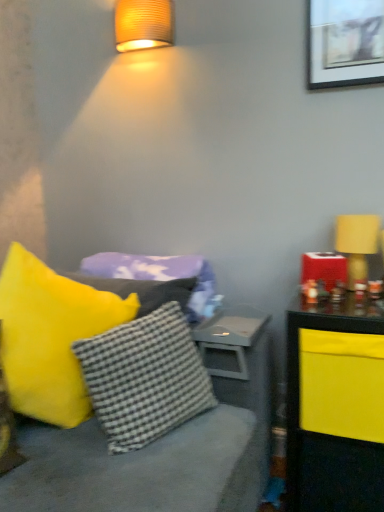
Question: Is yellow fabric lampshade at right to the right of gray matte table at center from the viewer's perspective?

Choices:
 (A) yes
 (B) no

Answer: (A)

Question: Is yellow fabric lampshade at right shorter than gray matte table at center?

Choices:
 (A) no
 (B) yes

Answer: (A)

Question: Is yellow fabric lampshade at right closer to the viewer compared to gray matte table at center?

Choices:
 (A) yes
 (B) no

Answer: (B)

Question: From a real-world perspective, is yellow fabric lampshade at right physically above gray matte table at center?

Choices:
 (A) no
 (B) yes

Answer: (B)

Question: Can you confirm if yellow fabric lampshade at right is bigger than gray matte table at center?

Choices:
 (A) no
 (B) yes

Answer: (A)

Question: From the image's perspective, is yellow fabric lampshade at right below gray matte table at center?

Choices:
 (A) no
 (B) yes

Answer: (A)

Question: From the image's perspective, is yellow fabric lampshade at right on top of yellow fabric pillow at left, which is the first pillow from front to back?

Choices:
 (A) yes
 (B) no

Answer: (A)

Question: Does yellow fabric lampshade at right have a lesser height compared to yellow fabric pillow at left, which is the first pillow from front to back?

Choices:
 (A) no
 (B) yes

Answer: (B)

Question: Can you confirm if yellow fabric lampshade at right is smaller than yellow fabric pillow at left, which is counted as the 3th pillow, starting from the back?

Choices:
 (A) no
 (B) yes

Answer: (B)

Question: Is yellow fabric lampshade at right positioned with its back to yellow fabric pillow at left, which is counted as the 3th pillow, starting from the back?

Choices:
 (A) yes
 (B) no

Answer: (B)

Question: Is yellow fabric lampshade at right next to yellow fabric pillow at left, which is counted as the 3th pillow, starting from the back, and touching it?

Choices:
 (A) no
 (B) yes

Answer: (A)

Question: Is yellow fabric lampshade at right completely or partially outside of yellow fabric pillow at left, which is the first pillow from front to back?

Choices:
 (A) yes
 (B) no

Answer: (A)

Question: Is yellow fabric lampshade at right surrounded by checkered fabric pillow at center, which ranks as the 2th pillow in back-to-front order?

Choices:
 (A) yes
 (B) no

Answer: (B)